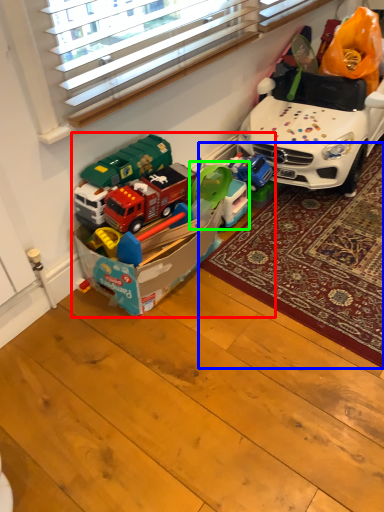
Question: Which object is positioned farthest from toy (highlighted by a red box)? Select from mat (highlighted by a blue box) and toy (highlighted by a green box).

Choices:
 (A) mat
 (B) toy

Answer: (A)